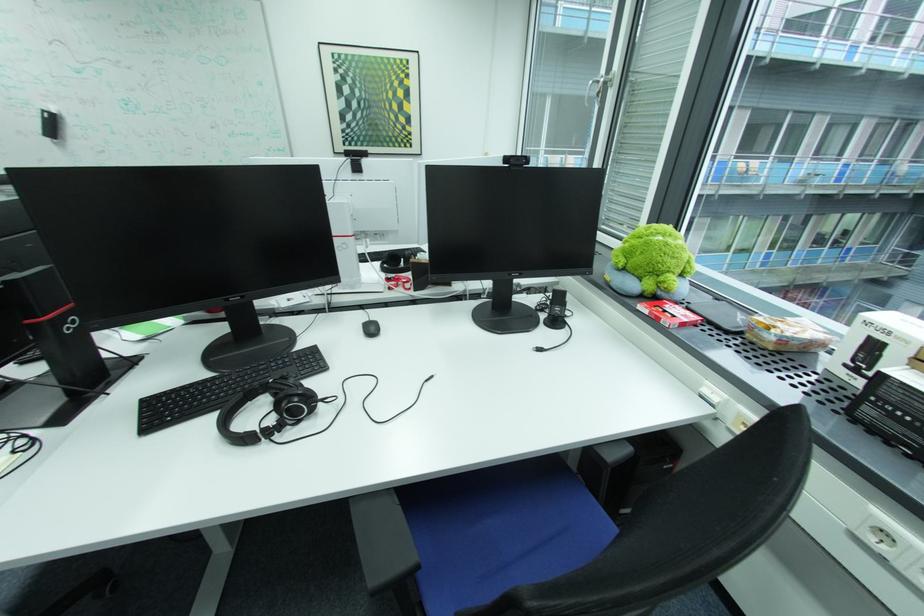
What do you see at coordinates (499, 546) in the screenshot? I see `a blue chair sitting surface` at bounding box center [499, 546].